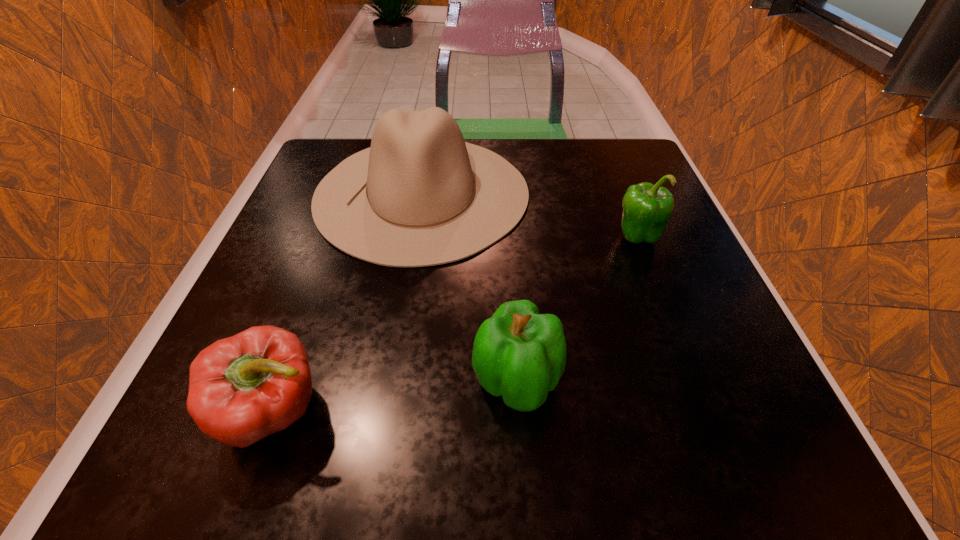
Image resolution: width=960 pixels, height=540 pixels. I want to click on empty space that is in between the tallest object and the second bell pepper from left to right, so click(469, 288).

The width and height of the screenshot is (960, 540). I want to click on empty location between the tallest object and the leftmost bell pepper, so click(348, 302).

Where is `free space that is in between the leftmost bell pepper and the sombrero`? This screenshot has width=960, height=540. free space that is in between the leftmost bell pepper and the sombrero is located at coordinates (348, 302).

Image resolution: width=960 pixels, height=540 pixels. I want to click on free area in between the second bell pepper from left to right and the tallest object, so click(x=469, y=288).

This screenshot has width=960, height=540. What are the coordinates of `free space between the leftmost bell pepper and the farthest bell pepper` in the screenshot? It's located at (455, 325).

Identify the location of free space between the rightmost bell pepper and the leftmost bell pepper. Image resolution: width=960 pixels, height=540 pixels. (455, 325).

This screenshot has height=540, width=960. Find the location of `free space between the rightmost bell pepper and the second bell pepper from right to left`. free space between the rightmost bell pepper and the second bell pepper from right to left is located at coordinates (576, 309).

Find the location of a particular element. The image size is (960, 540). free space between the farthest bell pepper and the tallest object is located at coordinates (529, 215).

Locate an element on the screen. free space that is in between the second bell pepper from left to right and the leftmost bell pepper is located at coordinates click(x=396, y=397).

What are the coordinates of `vacant space that is in between the leftmost bell pepper and the sombrero` in the screenshot? It's located at (348, 302).